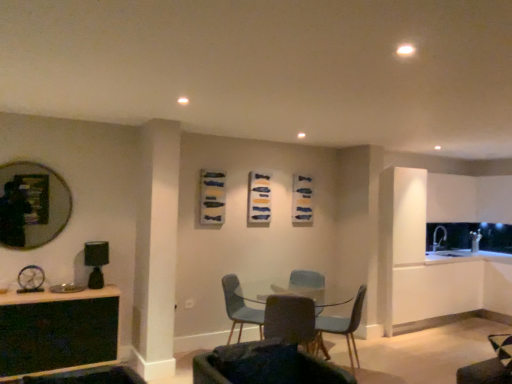
Locate an element on the screen. This screenshot has width=512, height=384. free point above black glass table at lower left (from a real-world perspective) is located at coordinates (54, 294).